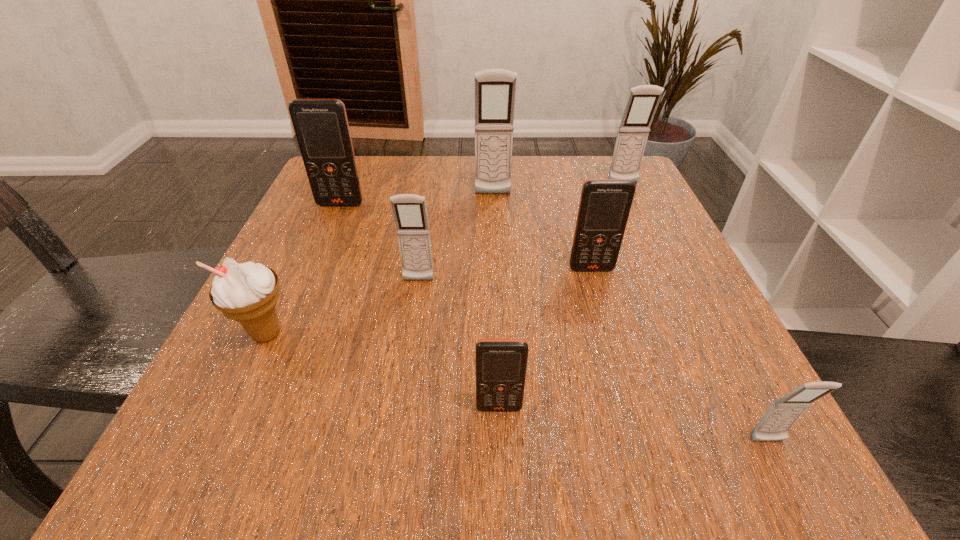
In the image, there is a desktop. Identify the location of vacant space at the near edge. (397, 480).

In the image, there is a desktop. Where is `free space at the left edge`? The height and width of the screenshot is (540, 960). free space at the left edge is located at coordinates (372, 230).

The width and height of the screenshot is (960, 540). In the image, there is a desktop. In order to click on blank space at the right edge in this screenshot , I will do `click(655, 313)`.

In the image, there is a desktop. Identify the location of free space at the far right corner. (653, 204).

The height and width of the screenshot is (540, 960). I want to click on free area in between the second nearest cellular telephone and the white icecream, so click(x=383, y=370).

Where is `free space between the second biggest orange cellular telephone and the seventh farthest object`? The image size is (960, 540). free space between the second biggest orange cellular telephone and the seventh farthest object is located at coordinates (545, 338).

Where is `unoccupied area between the nearest cellular telephone and the seventh farthest object`? unoccupied area between the nearest cellular telephone and the seventh farthest object is located at coordinates (634, 424).

In order to click on vacant area that lies between the smallest gray cellular telephone and the fifth nearest object in this screenshot , I will do `click(680, 355)`.

Find the location of a particular element. free space between the nearest orange cellular telephone and the icecream is located at coordinates (383, 370).

Where is `unoccupied position between the rightmost orange cellular telephone and the biggest gray cellular telephone`? The width and height of the screenshot is (960, 540). unoccupied position between the rightmost orange cellular telephone and the biggest gray cellular telephone is located at coordinates (542, 232).